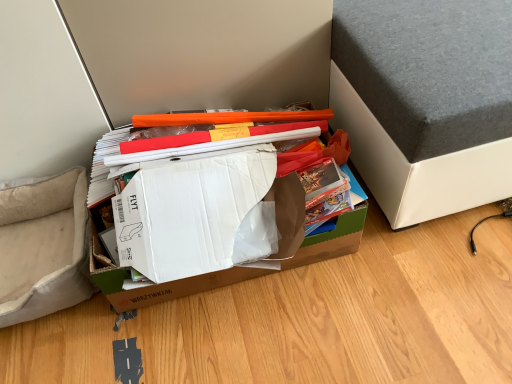
Question: Is gray fabric bed at upper right facing away from beige fabric armchair at lower left?

Choices:
 (A) no
 (B) yes

Answer: (A)

Question: Does gray fabric bed at upper right have a larger size compared to beige fabric armchair at lower left?

Choices:
 (A) no
 (B) yes

Answer: (B)

Question: Does gray fabric bed at upper right come behind beige fabric armchair at lower left?

Choices:
 (A) yes
 (B) no

Answer: (B)

Question: From the image's perspective, is gray fabric bed at upper right on top of beige fabric armchair at lower left?

Choices:
 (A) yes
 (B) no

Answer: (A)

Question: Does gray fabric bed at upper right turn towards beige fabric armchair at lower left?

Choices:
 (A) no
 (B) yes

Answer: (A)

Question: Is gray fabric bed at upper right completely or partially outside of beige fabric armchair at lower left?

Choices:
 (A) yes
 (B) no

Answer: (A)

Question: From a real-world perspective, is beige fabric armchair at lower left positioned under brown cardboard box at center based on gravity?

Choices:
 (A) yes
 (B) no

Answer: (A)

Question: Is beige fabric armchair at lower left bigger than brown cardboard box at center?

Choices:
 (A) yes
 (B) no

Answer: (B)

Question: Is beige fabric armchair at lower left positioned before brown cardboard box at center?

Choices:
 (A) no
 (B) yes

Answer: (A)

Question: Can we say beige fabric armchair at lower left lies outside brown cardboard box at center?

Choices:
 (A) yes
 (B) no

Answer: (A)

Question: Considering the relative sizes of beige fabric armchair at lower left and brown cardboard box at center in the image provided, is beige fabric armchair at lower left thinner than brown cardboard box at center?

Choices:
 (A) no
 (B) yes

Answer: (B)

Question: Is beige fabric armchair at lower left touching brown cardboard box at center?

Choices:
 (A) no
 (B) yes

Answer: (A)

Question: From a real-world perspective, is brown cardboard box at center over gray fabric bed at upper right?

Choices:
 (A) yes
 (B) no

Answer: (B)